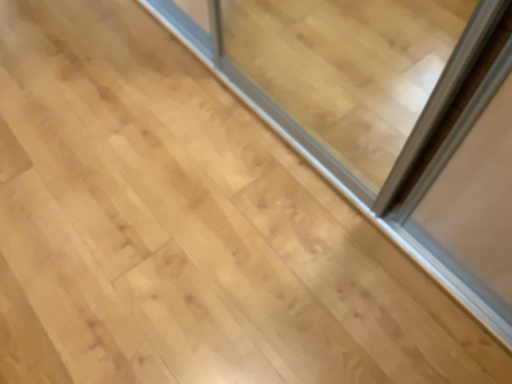
You are a GUI agent. You are given a task and a screenshot of the screen. Output one action in this format:
    pyautogui.click(x=<x>, y=<y>)
    Task: Click on the empty space that is ontop of transparent glass window at upper right (from a real-world perspective)
    
    Given the screenshot: What is the action you would take?
    pyautogui.click(x=195, y=172)